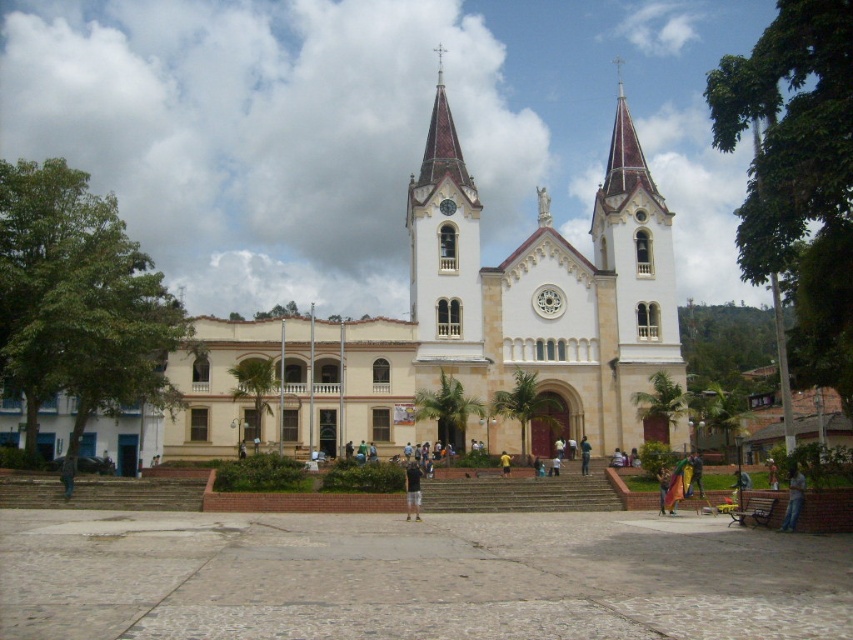
Which is in front, point (601, 496) or point (788, 502)?

Point (788, 502) is more forward.

Can you confirm if brown stone stairs at center is taller than denim jeans at lower right?

Yes.

Is point (457, 481) positioned behind point (786, 524)?

Yes.

I want to click on brown stone stairs at center, so click(515, 492).

Can you confirm if white stone church at center is positioned below green fabric pants at center?

Incorrect, white stone church at center is not positioned below green fabric pants at center.

Does white stone church at center have a greater height compared to green fabric pants at center?

Yes.

Is point (602, 356) closer to viewer compared to point (582, 435)?

No, (602, 356) is behind (582, 435).

You are a GUI agent. You are given a task and a screenshot of the screen. Output one action in this format:
    pyautogui.click(x=<x>, y=<y>)
    Task: Click on the white stone church at center
    
    Given the screenshot: What is the action you would take?
    pyautogui.click(x=466, y=326)

Is brown stone stairs at center below brown leather jacket at lower left?

Yes.

Who is shorter, brown stone stairs at center or brown leather jacket at lower left?

Standing shorter between the two is brown leather jacket at lower left.

This screenshot has width=853, height=640. Find the location of `brown stone stairs at center`. brown stone stairs at center is located at coordinates (515, 492).

The image size is (853, 640). In order to click on brown stone stairs at center in this screenshot , I will do `click(515, 492)`.